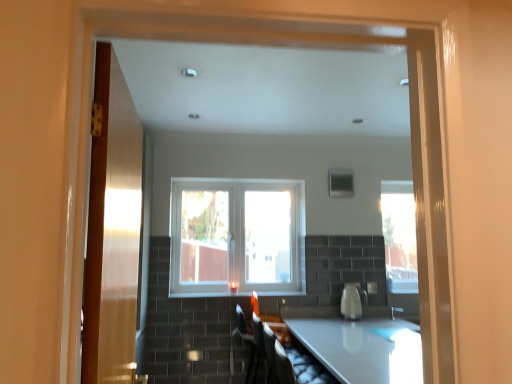
Question: From a real-world perspective, relative to matte black armchair at lower center, which is the first armchair from front to back, is matte black armchair at lower center, which is the 2th armchair from front to back, vertically above or below?

Choices:
 (A) below
 (B) above

Answer: (A)

Question: Visually, is matte black armchair at lower center, which is the 2th armchair from front to back, positioned to the left or to the right of matte black armchair at lower center, marked as the 2th armchair in a back-to-front arrangement?

Choices:
 (A) left
 (B) right

Answer: (A)

Question: Estimate the real-world distances between objects in this image. Which object is farther from the matte black armchair at lower center, which appears as the 1th armchair when viewed from the back?

Choices:
 (A) wooden door at left
 (B) white plastic window at center
 (C) matte black armchair at lower center, marked as the 2th armchair in a back-to-front arrangement
 (D) white glossy kettle at center
 (E) white glossy countertop at center

Answer: (A)

Question: Considering the real-world distances, which object is closest to the white glossy kettle at center?

Choices:
 (A) matte black armchair at lower center, which is the first armchair from front to back
 (B) wooden door at left
 (C) white plastic window at center
 (D) matte black armchair at lower center, which is the 2th armchair from front to back
 (E) white glossy countertop at center

Answer: (E)